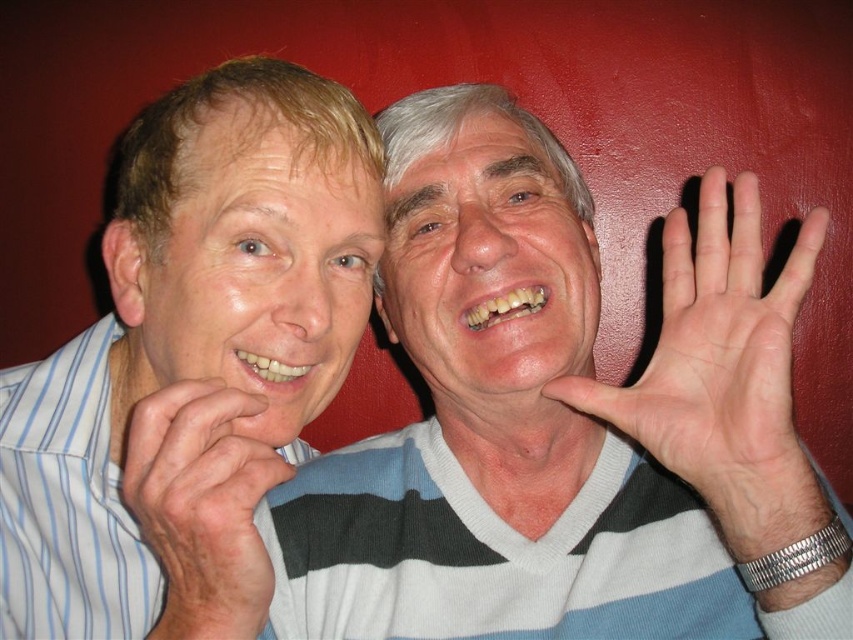
Is matte white face at left thinner than pale skin palm at center?

No, matte white face at left is not thinner than pale skin palm at center.

Find the location of `matte white face at left`. matte white face at left is located at coordinates (257, 269).

This screenshot has height=640, width=853. Describe the element at coordinates (257, 269) in the screenshot. I see `matte white face at left` at that location.

Find the location of a particular element. The width and height of the screenshot is (853, 640). matte white face at left is located at coordinates (257, 269).

Can you confirm if white striped sweater at center is smaller than matte white face at left?

Incorrect, white striped sweater at center is not smaller in size than matte white face at left.

Is white striped sweater at center thinner than matte white face at left?

In fact, white striped sweater at center might be wider than matte white face at left.

The width and height of the screenshot is (853, 640). Find the location of `white striped sweater at center`. white striped sweater at center is located at coordinates (500, 429).

Based on the photo, who is lower down, smooth skin face at center or dry skin hand at lower left?

dry skin hand at lower left is lower down.

Does smooth skin face at center have a larger size compared to dry skin hand at lower left?

Indeed, smooth skin face at center has a larger size compared to dry skin hand at lower left.

Who is more forward, (468, 118) or (207, 456)?

Point (207, 456) is more forward.

Image resolution: width=853 pixels, height=640 pixels. In order to click on smooth skin face at center in this screenshot , I will do `click(488, 264)`.